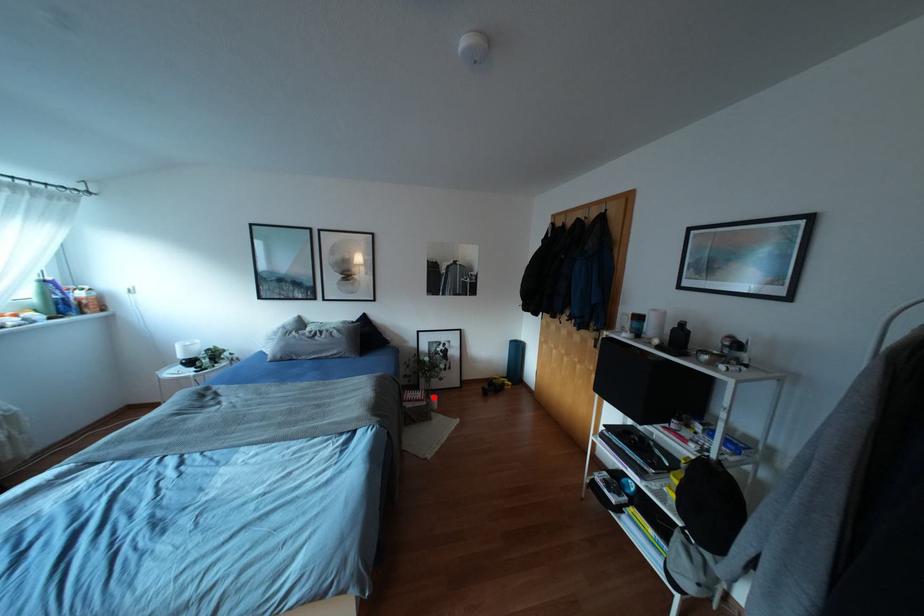
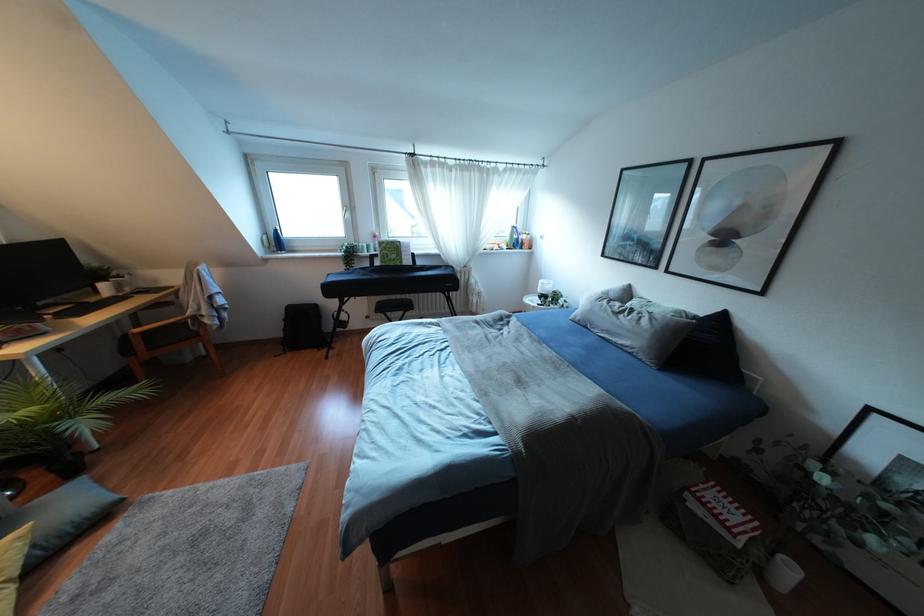
Locate, in the second image, the point that corresponds to the highlighted location in the first image.

(791, 570)